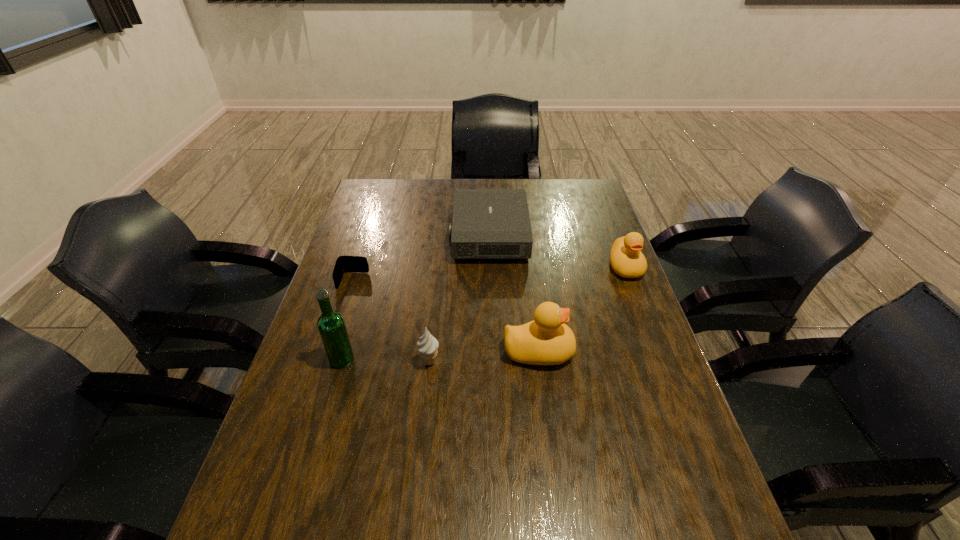
All ducks are currently evenly spaced. To continue this pattern, where would you add another duck on the left? Please point out a vacant spot. Please provide its 2D coordinates. Your answer should be formatted as a tuple, i.e. [(x, y)], where the tuple contains the x and y coordinates of a point satisfying the conditions above.

[(401, 484)]